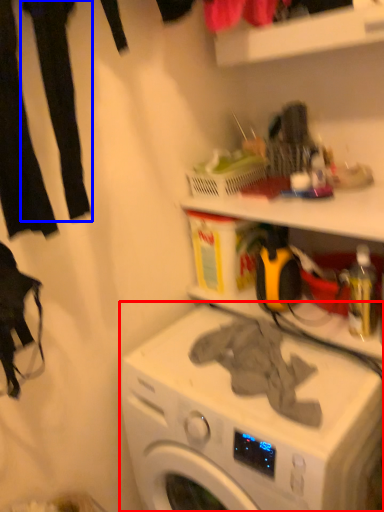
Question: Which object appears farthest to the camera in this image, washing machine (highlighted by a red box) or clothing (highlighted by a blue box)?

Choices:
 (A) washing machine
 (B) clothing

Answer: (A)